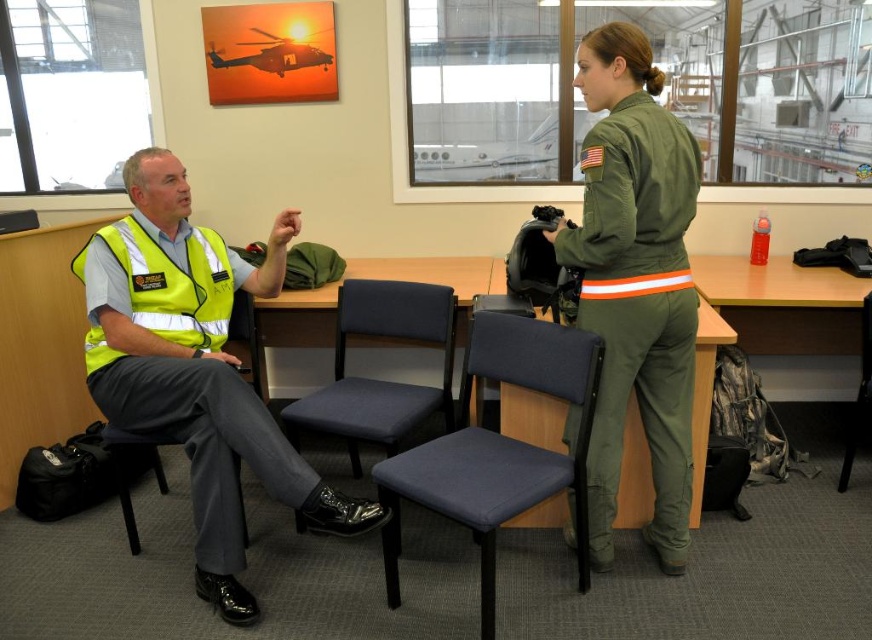
You are a visitor at the aviation facility and want to sit down at the wooden table at center. However, there is a black fabric chair at center in the way. Can you walk directly to the table without moving the chair?

The black fabric chair at center is behind wooden table at center, so you can walk directly to the table without moving the chair because the chair is positioned behind it and not blocking the path.

You are planning to place a large rectangular box on the wooden table at center. The box is as wide as the black fabric chair at center. Will the box fit on the table?

The wooden table at center is wider than the black fabric chair at center, so the box, which is as wide as the black fabric chair at center, will fit on the wooden table at center.

You are an inspector in the hangar and need to sit on the black fabric chair at center to review documents on the wooden table at center. Can you sit on the chair without moving the table?

The wooden table at center is positioned over black fabric chair at center, so you cannot sit on the chair without moving the table first.